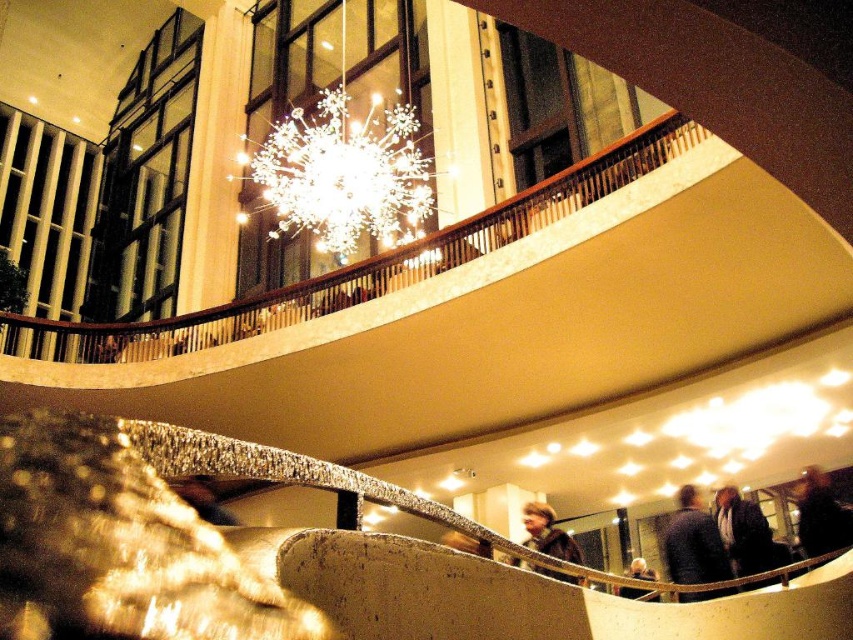
Can you confirm if dark gray suit at lower right is thinner than dark brown leather jacket at lower right?

Indeed, dark gray suit at lower right has a lesser width compared to dark brown leather jacket at lower right.

Based on the photo, can you confirm if dark gray suit at lower right is positioned below dark brown leather jacket at lower right?

No, dark gray suit at lower right is not below dark brown leather jacket at lower right.

Measure the distance between dark gray suit at lower right and camera.

A distance of 9.52 meters exists between dark gray suit at lower right and camera.

Image resolution: width=853 pixels, height=640 pixels. In order to click on dark gray suit at lower right in this screenshot , I will do `click(743, 532)`.

Which is above, dark blue sweater at lower right or dark brown leather jacket at center?

dark brown leather jacket at center

Is dark blue sweater at lower right wider than dark brown leather jacket at center?

Yes, dark blue sweater at lower right is wider than dark brown leather jacket at center.

Identify the location of dark blue sweater at lower right. This screenshot has height=640, width=853. (693, 544).

Between point (679, 506) and point (810, 481), which one is positioned behind?

Point (679, 506)

Is dark blue sweater at lower right further to the viewer compared to dark brown leather jacket at lower right?

That is False.

The image size is (853, 640). Identify the location of dark blue sweater at lower right. (693, 544).